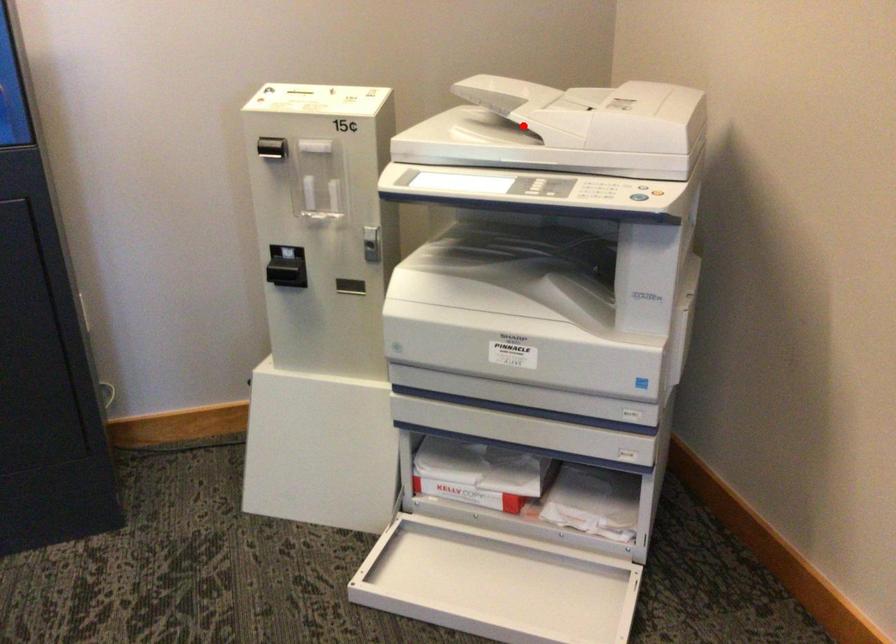
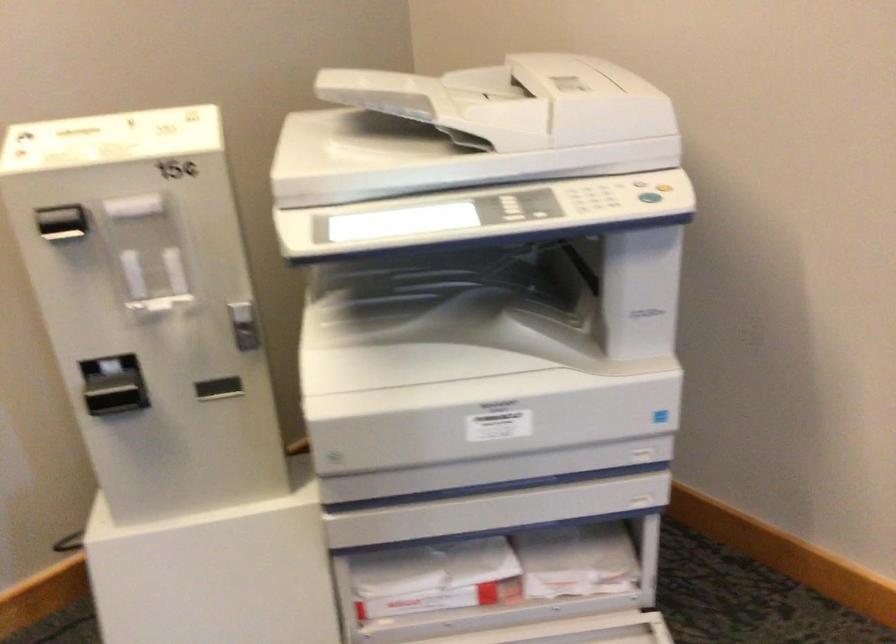
Question: I am providing you with two images of the same scene from different viewpoints. Image1 has a red point marked. In image2, the corresponding 3D location appears at what relative position? Reply with the corresponding letter.

Choices:
 (A) Closer
 (B) Farther

Answer: (A)